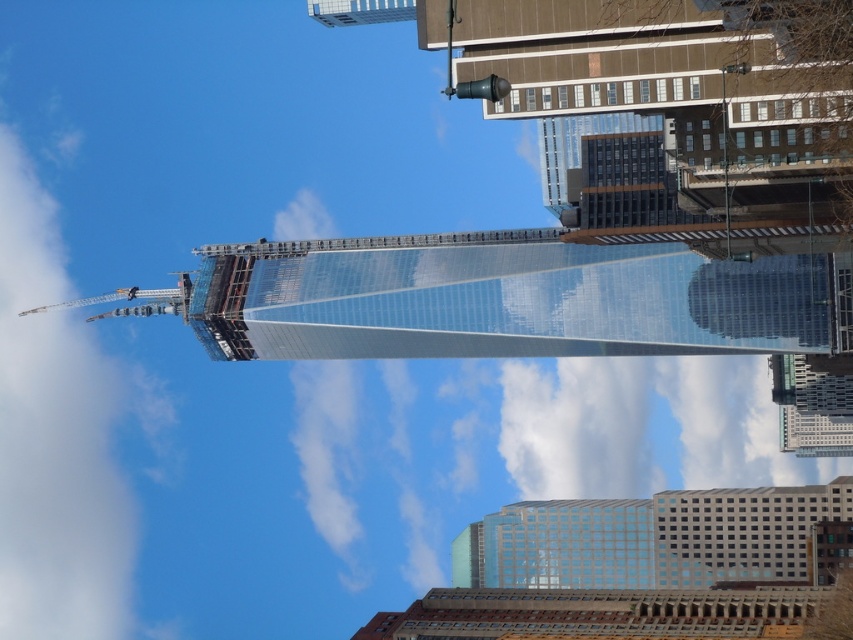
Question: Which of these objects is positioned closest to the white glass building at lower right?

Choices:
 (A) transparent glass building at right
 (B) metallic silver crane at upper left

Answer: (A)

Question: Which point is closer to the camera?

Choices:
 (A) (723, 332)
 (B) (788, 516)
 (C) (91, 298)

Answer: (B)

Question: Can you confirm if white glass building at lower right is positioned to the right of metallic silver crane at upper left?

Choices:
 (A) no
 (B) yes

Answer: (B)

Question: Which of the following is the farthest from the observer?

Choices:
 (A) (177, 285)
 (B) (813, 291)

Answer: (A)

Question: Does white glass building at lower right have a lesser width compared to metallic silver crane at upper left?

Choices:
 (A) no
 (B) yes

Answer: (B)

Question: Does transparent glass building at right have a larger size compared to metallic silver crane at upper left?

Choices:
 (A) no
 (B) yes

Answer: (A)